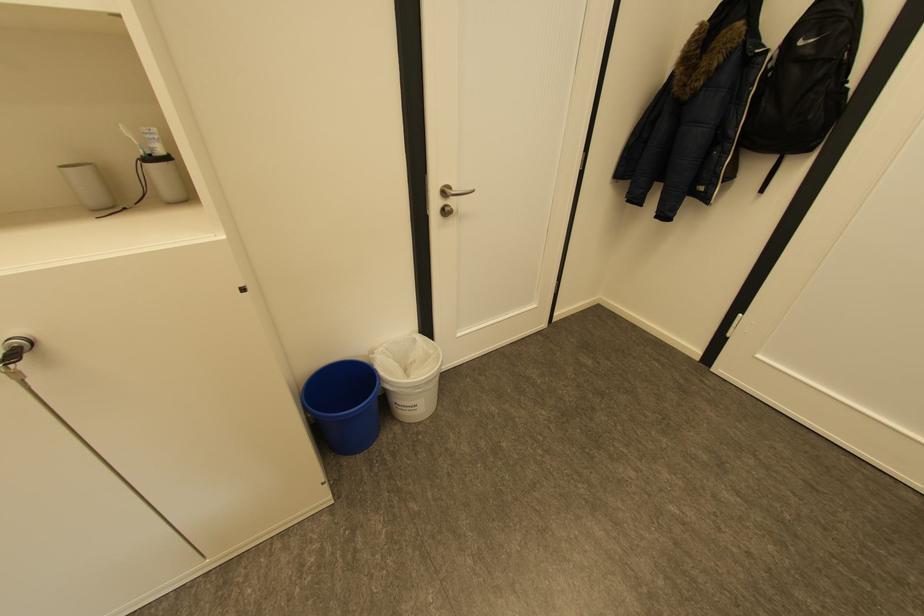
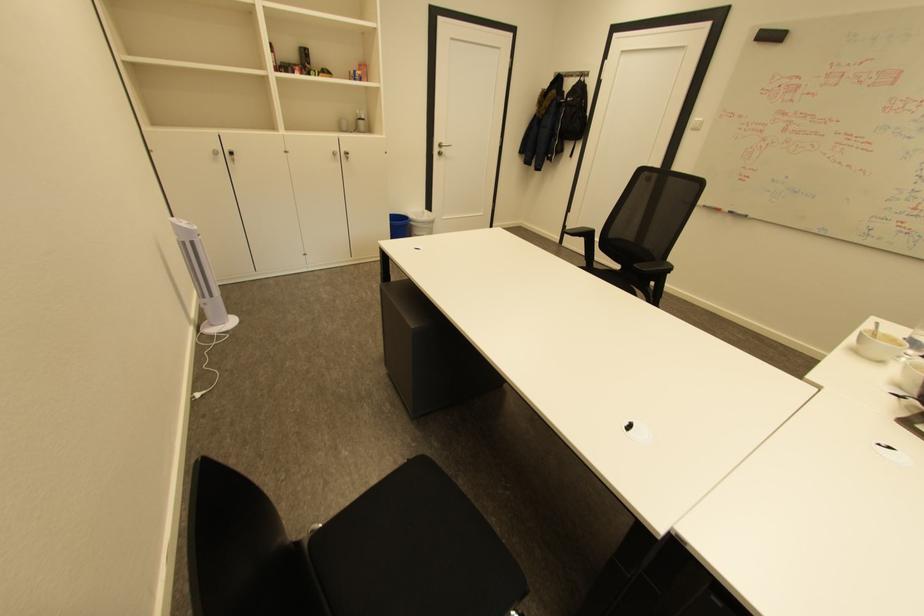
The point at [427,392] is marked in the first image. Where is the corresponding point in the second image?

(432, 227)